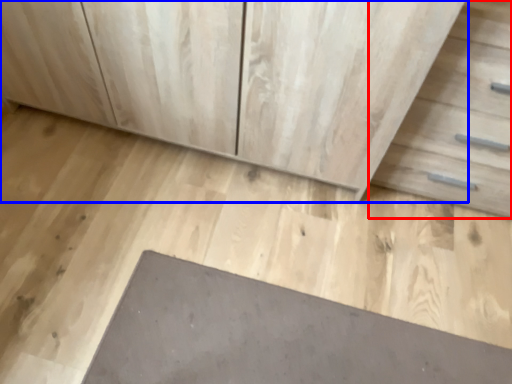
Question: Which object appears closest to the camera in this image, drawer (highlighted by a red box) or chest of drawers (highlighted by a blue box)?

Choices:
 (A) drawer
 (B) chest of drawers

Answer: (A)